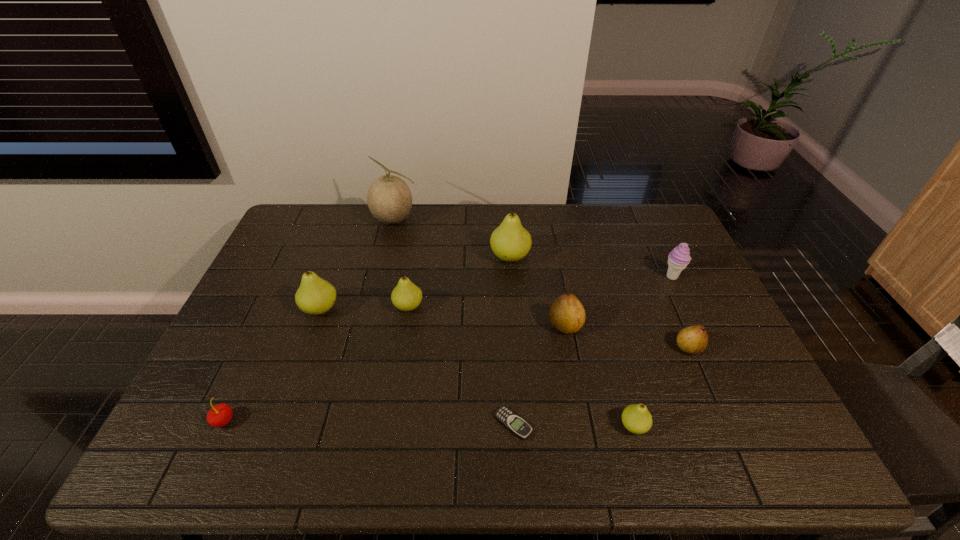
The image size is (960, 540). Identify the location of the farthest object. (389, 198).

Identify the location of the third green pear from left to right. Image resolution: width=960 pixels, height=540 pixels. (510, 242).

I want to click on the farthest pear, so click(x=510, y=242).

The height and width of the screenshot is (540, 960). I want to click on the leftmost green pear, so click(315, 296).

Identify the location of the fifth shortest pear. The image size is (960, 540). (315, 296).

This screenshot has height=540, width=960. I want to click on icecream, so click(679, 258).

Locate an element on the screen. the third biggest green pear is located at coordinates (406, 296).

Where is `the third green pear from right to left`? the third green pear from right to left is located at coordinates (406, 296).

You are a GUI agent. You are given a task and a screenshot of the screen. Output one action in this format:
    pyautogui.click(x=<x>, y=<y>)
    Task: Click on the left brown pear
    This screenshot has height=540, width=960.
    Given the screenshot: What is the action you would take?
    pyautogui.click(x=567, y=315)

This screenshot has width=960, height=540. I want to click on the seventh object from left to right, so click(x=567, y=315).